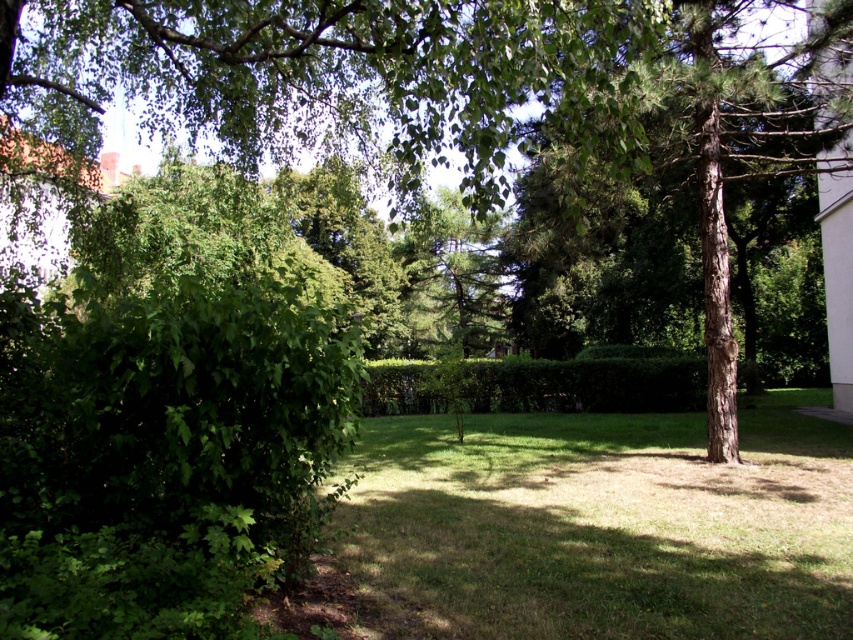
You are a gardener who needs to place a 6 meter long fence between the brown rough bark tree at center and the green leafy hedge at center. Can the fence fit between them without overlapping either?

The distance between the brown rough bark tree at center and the green leafy hedge at center is 5.80 meters. Since the fence is 6 meters long, it would be 0.20 meters too long to fit between them without overlapping either.